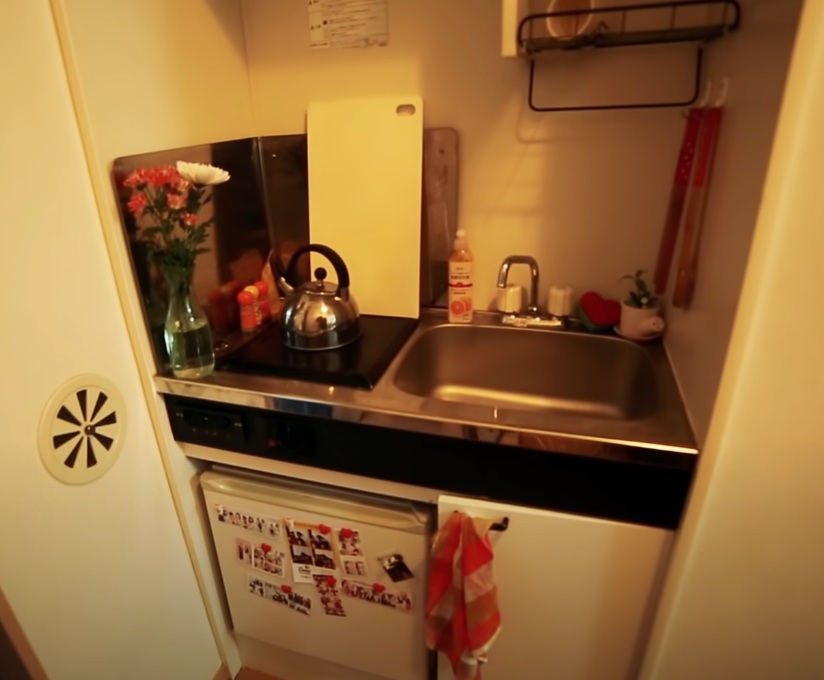
The image size is (824, 680). I want to click on electric stove, so click(363, 362).